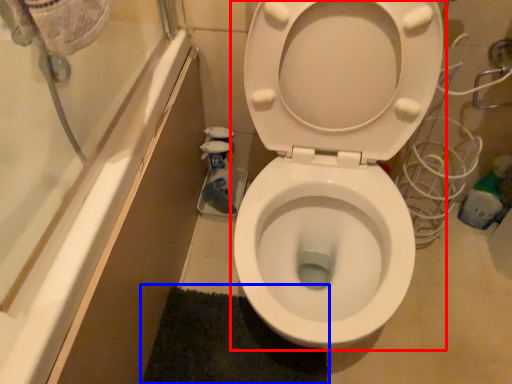
Question: Among these objects, which one is farthest to the camera, toilet (highlighted by a red box) or bath mat (highlighted by a blue box)?

Choices:
 (A) toilet
 (B) bath mat

Answer: (B)